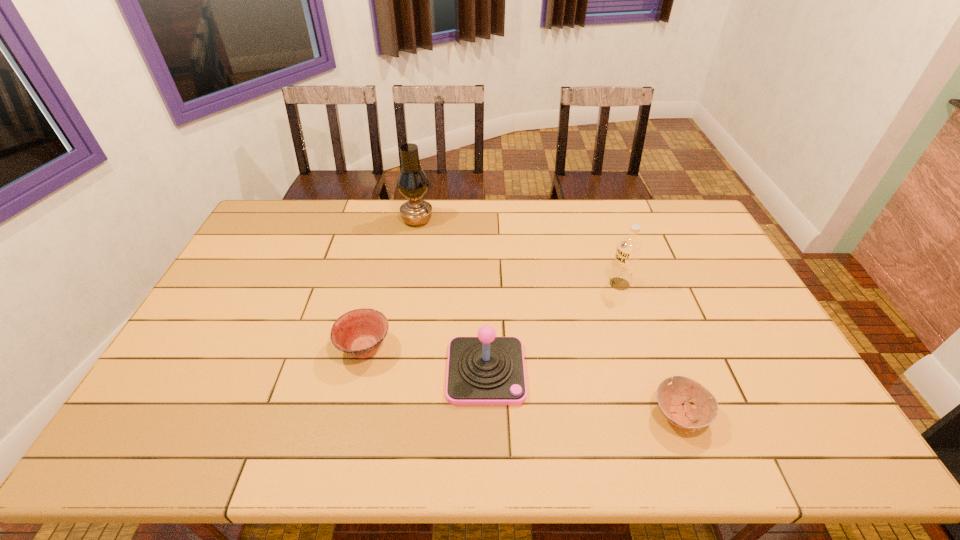
Locate an element on the screen. The height and width of the screenshot is (540, 960). free spot between the tallest object and the second shortest object is located at coordinates (391, 284).

Locate an element on the screen. vacant space that's between the oil lamp and the second farthest object is located at coordinates (518, 252).

The image size is (960, 540). In order to click on vacant area between the joystick and the shorter bowl in this screenshot , I will do `click(583, 393)`.

Image resolution: width=960 pixels, height=540 pixels. Find the location of `vacant area between the taller bowl and the tallest object`. vacant area between the taller bowl and the tallest object is located at coordinates (391, 284).

Locate an element on the screen. The image size is (960, 540). vacant space that is in between the oil lamp and the shorter bowl is located at coordinates (x=548, y=317).

Locate which object ranks in proximity to the left bowl. Please provide its 2D coordinates. Your answer should be formatted as a tuple, i.e. [(x, y)], where the tuple contains the x and y coordinates of a point satisfying the conditions above.

[(486, 370)]

Locate which object is the second closest to the third shortest object. Please provide its 2D coordinates. Your answer should be formatted as a tuple, i.e. [(x, y)], where the tuple contains the x and y coordinates of a point satisfying the conditions above.

[(670, 398)]